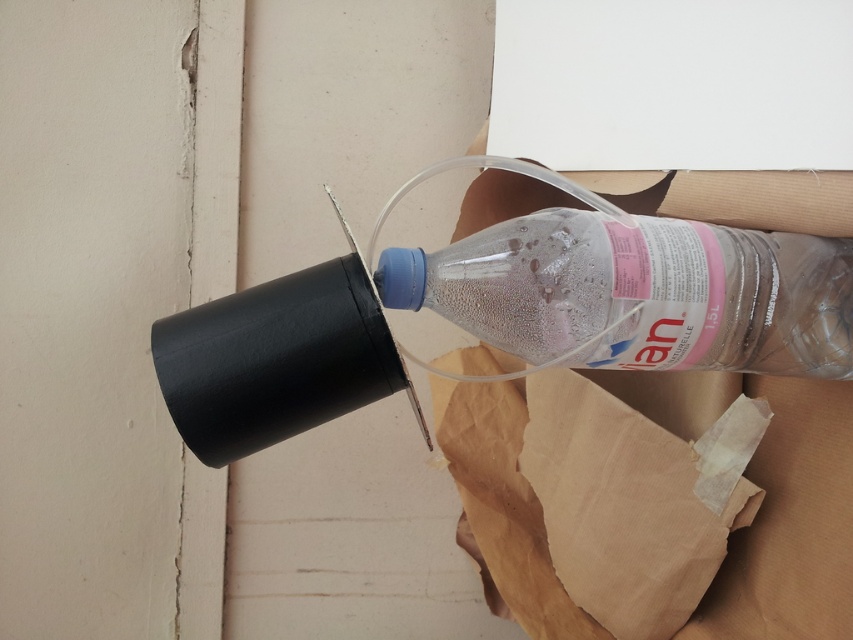
From the picture: You are trying to locate the transparent paper in the image. Given that the coordinate system starts from the bottom left corner of the image, can you determine whether the transparent paper at upper right is closer to the top edge or the right edge?

The transparent paper at upper right is located at coordinate point 0.789 on the x axis and 0.767 on the y axis. Since both coordinates are close to 1, it means it is near the top right corner. Comparing the two, the x coordinate is slightly larger than the y coordinate, so it is closer to the right edge than the top edge.

You are trying to determine which object is taller between the transparent paper at upper right and the transparent plastic bottle at center. Based on the scene, which one is taller?

The transparent paper at upper right has a greater height compared to the transparent plastic bottle at center, so the transparent paper at upper right is taller.

You are setting up a small experiment and need to know which object is wider. You have a transparent paper at upper right and a black matte wine bottle at upper center in your setup. Which one has a smaller width?

The transparent paper at upper right has a smaller width than the black matte wine bottle at upper center.